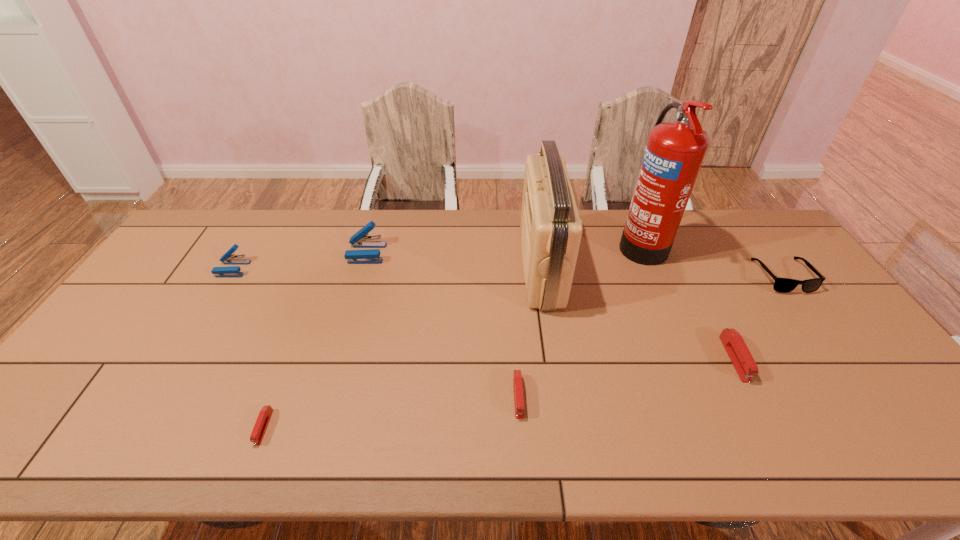
This screenshot has height=540, width=960. Identify the location of free spot at the far edge of the desktop. (418, 249).

The height and width of the screenshot is (540, 960). Find the location of `vacant space at the near edge of the desktop`. vacant space at the near edge of the desktop is located at coordinates (245, 440).

Locate an element on the screen. vacant space at the left edge of the desktop is located at coordinates (156, 303).

This screenshot has width=960, height=540. I want to click on vacant area at the far right corner, so click(x=767, y=224).

This screenshot has height=540, width=960. Identify the location of free space that is in between the leftmost red stapler and the tallest stapler. (315, 340).

Find the location of a particular element. free space between the fifth object from right to left and the rightmost object is located at coordinates (650, 336).

Locate an element on the screen. free space that is in between the seventh shortest object and the sunglasses is located at coordinates (662, 272).

Where is `free spot between the tallest object and the shortest stapler`? free spot between the tallest object and the shortest stapler is located at coordinates (452, 335).

At what (x,y) coordinates should I click in order to perform the action: click on free space between the leftmost object and the fire extinguisher. Please return your answer as a coordinate pair (x, y). The width and height of the screenshot is (960, 540). Looking at the image, I should click on (437, 256).

I want to click on empty location between the fourth tallest object and the second object from right to left, so click(x=484, y=314).